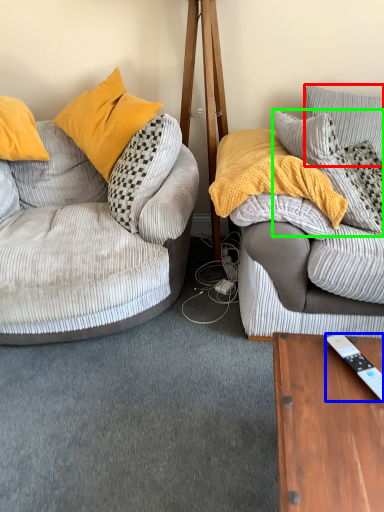
Question: Which object is positioned closest to pillow (highlighted by a red box)? Select from remote control (highlighted by a blue box) and pillow (highlighted by a green box).

Choices:
 (A) remote control
 (B) pillow

Answer: (B)